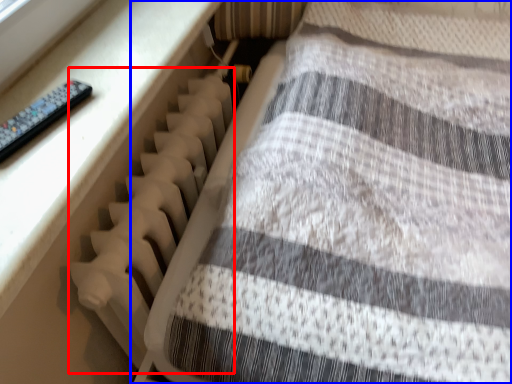
Question: Which of the following is the farthest to the observer, radiator (highlighted by a red box) or furniture (highlighted by a blue box)?

Choices:
 (A) radiator
 (B) furniture

Answer: (A)